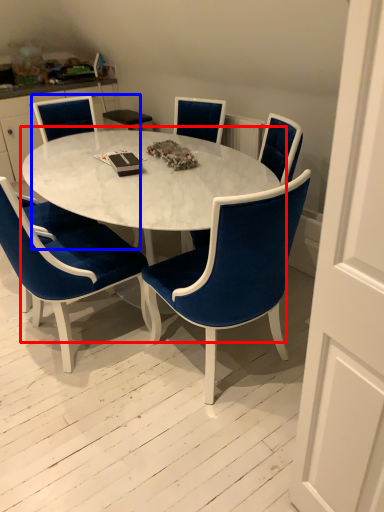
Question: Which object appears farthest to the camera in this image, coffee table (highlighted by a red box) or chair (highlighted by a blue box)?

Choices:
 (A) coffee table
 (B) chair

Answer: (B)